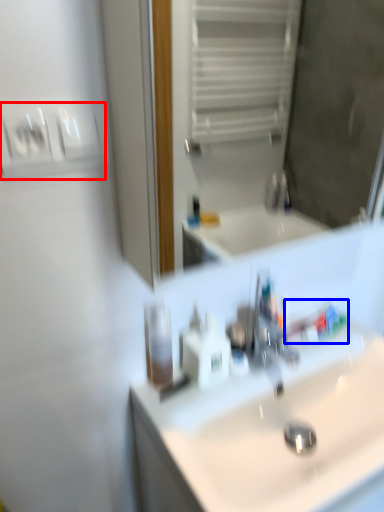
Question: Which object appears farthest to the camera in this image, light switch (highlighted by a red box) or toothpaste (highlighted by a blue box)?

Choices:
 (A) light switch
 (B) toothpaste

Answer: (B)